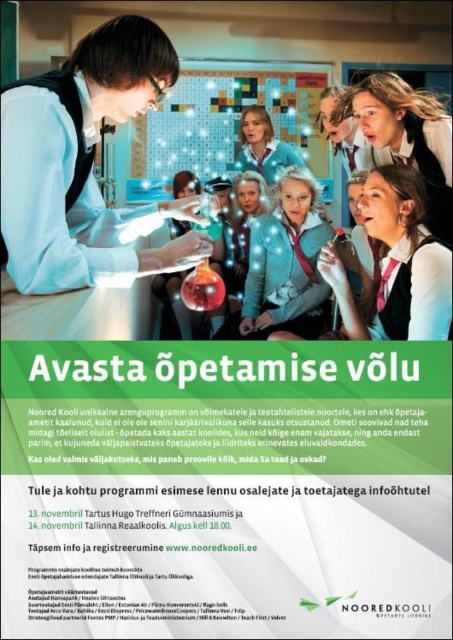
You are standing in front of the poster and want to touch the point at coordinates point (85, 544). If your hand can reach up to 1 meter, can you reach it?

The point (85, 544) is 1.16 meters away from the viewer, so your hand can not reach it since it requires reaching 1.16 meters which exceeds your 1 meter limit.

You are designing a layout for a promotional poster and need to place the white paper at center and the metallic silver bulletin board at center. According to the scene description, which object takes up more space on the poster?

The metallic silver bulletin board at center takes up more space on the poster because the white paper at center occupies less space than it.